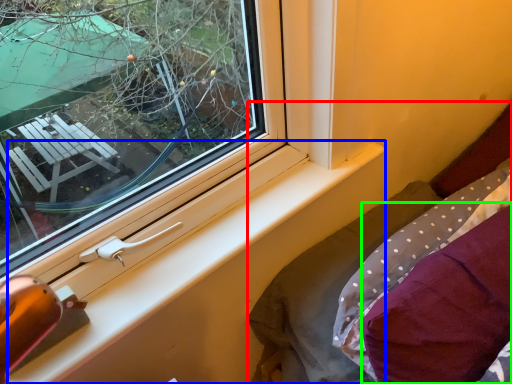
Question: Which object is positioned farthest from bed (highlighted by a red box)? Select from window sill (highlighted by a blue box) and pillow (highlighted by a green box).

Choices:
 (A) window sill
 (B) pillow

Answer: (A)